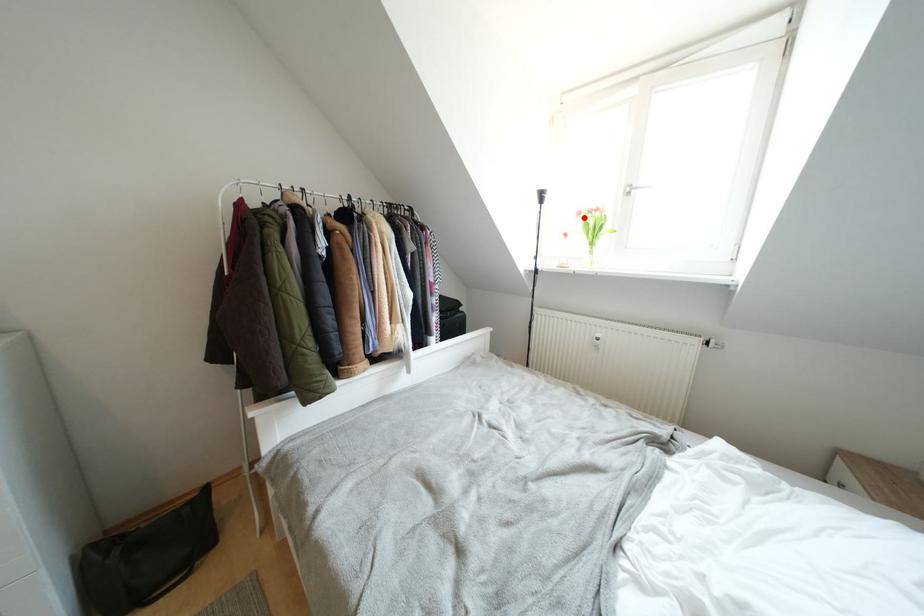
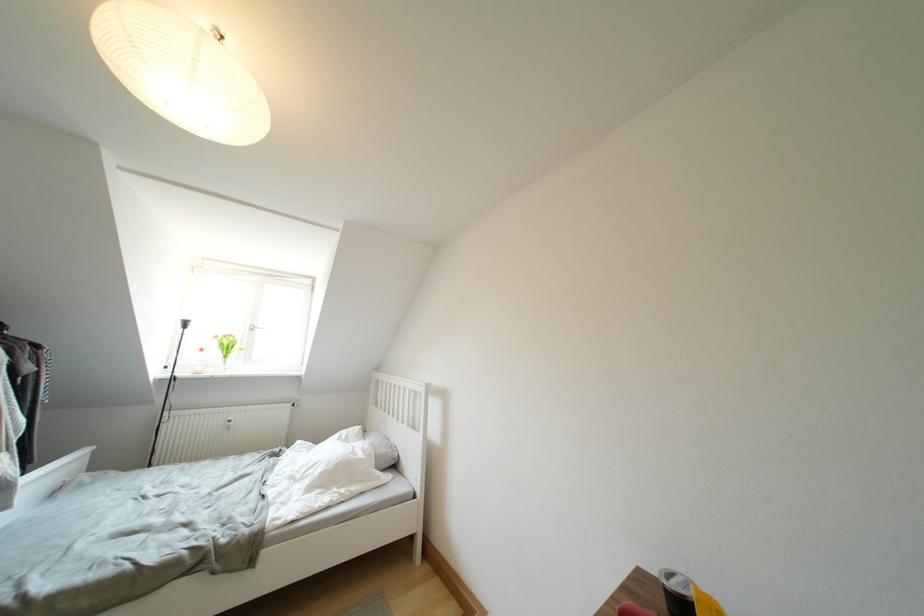
Find the pixel in the second image that matches the highlighted location in the first image.

(222, 341)